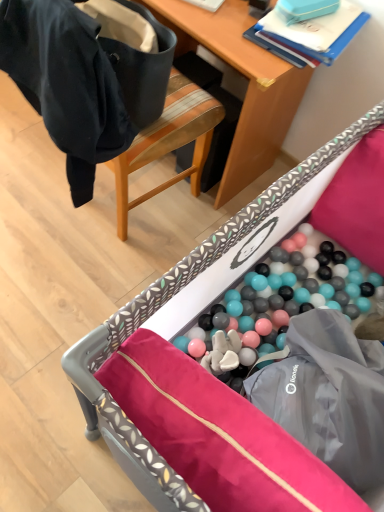
Question: Can you confirm if wooden desk at upper center is bigger than plastic ball pit at lower center?

Choices:
 (A) no
 (B) yes

Answer: (A)

Question: Is wooden desk at upper center far from plastic ball pit at lower center?

Choices:
 (A) yes
 (B) no

Answer: (B)

Question: Can you confirm if wooden desk at upper center is positioned to the right of plastic ball pit at lower center?

Choices:
 (A) yes
 (B) no

Answer: (B)

Question: Is wooden desk at upper center located outside plastic ball pit at lower center?

Choices:
 (A) no
 (B) yes

Answer: (B)

Question: Would you say plastic ball pit at lower center is part of wooden desk at upper center's contents?

Choices:
 (A) yes
 (B) no

Answer: (B)

Question: In terms of width, does black fabric chair at upper left look wider or thinner when compared to plastic ball pit at lower center?

Choices:
 (A) thin
 (B) wide

Answer: (A)

Question: Is black fabric chair at upper left to the left or to the right of plastic ball pit at lower center in the image?

Choices:
 (A) left
 (B) right

Answer: (A)

Question: Considering the positions of point (129, 160) and point (221, 232), is point (129, 160) closer or farther from the camera than point (221, 232)?

Choices:
 (A) closer
 (B) farther

Answer: (B)

Question: From the image's perspective, is black fabric chair at upper left located above or below plastic ball pit at lower center?

Choices:
 (A) below
 (B) above

Answer: (B)

Question: In the image, is plastic ball pit at lower center on the left side or the right side of black fabric chair at upper left?

Choices:
 (A) right
 (B) left

Answer: (A)

Question: From the image's perspective, relative to black fabric chair at upper left, is plastic ball pit at lower center above or below?

Choices:
 (A) above
 (B) below

Answer: (B)

Question: In terms of width, does plastic ball pit at lower center look wider or thinner when compared to black fabric chair at upper left?

Choices:
 (A) thin
 (B) wide

Answer: (B)

Question: In terms of size, does plastic ball pit at lower center appear bigger or smaller than black fabric chair at upper left?

Choices:
 (A) small
 (B) big

Answer: (B)

Question: From their relative heights in the image, would you say wooden desk at upper center is taller or shorter than black fabric chair at upper left?

Choices:
 (A) short
 (B) tall

Answer: (A)

Question: In the image, is wooden desk at upper center on the left side or the right side of black fabric chair at upper left?

Choices:
 (A) left
 (B) right

Answer: (B)